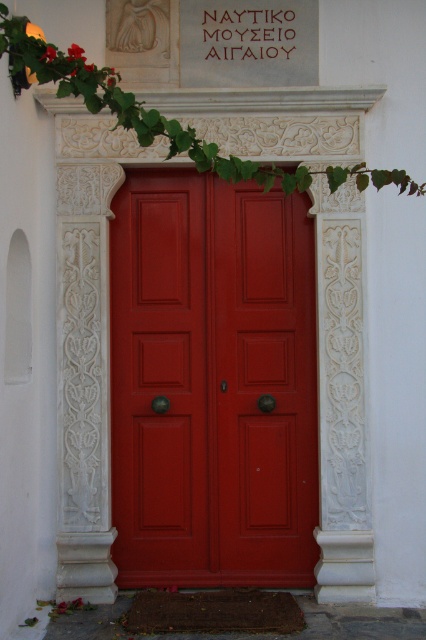
Can you confirm if glossy wood door at center is shorter than matte wood door at center?

No.

Is glossy wood door at center thinner than matte wood door at center?

No, glossy wood door at center is not thinner than matte wood door at center.

At what (x,y) coordinates should I click in order to perform the action: click on glossy wood door at center. Please return your answer as a coordinate pair (x, y). The image size is (426, 640). Looking at the image, I should click on (212, 381).

Where is `glossy wood door at center`? Image resolution: width=426 pixels, height=640 pixels. glossy wood door at center is located at coordinates [x=212, y=381].

Does matte wood door at center have a larger size compared to green leafy ivy at upper center?

Incorrect, matte wood door at center is not larger than green leafy ivy at upper center.

Is point (175, 412) farther from viewer compared to point (92, 100)?

Yes, point (175, 412) is behind point (92, 100).

The width and height of the screenshot is (426, 640). I want to click on matte wood door at center, so tap(164, 380).

Between glossy wood door at center and green leafy ivy at upper center, which one appears on the left side from the viewer's perspective?

Positioned to the left is green leafy ivy at upper center.

In the scene shown: Can you confirm if glossy wood door at center is positioned above green leafy ivy at upper center?

Incorrect, glossy wood door at center is not positioned above green leafy ivy at upper center.

Does point (221, 289) come farther from viewer compared to point (57, 51)?

Yes, it is behind point (57, 51).

Image resolution: width=426 pixels, height=640 pixels. In order to click on glossy wood door at center in this screenshot , I will do `click(212, 381)`.